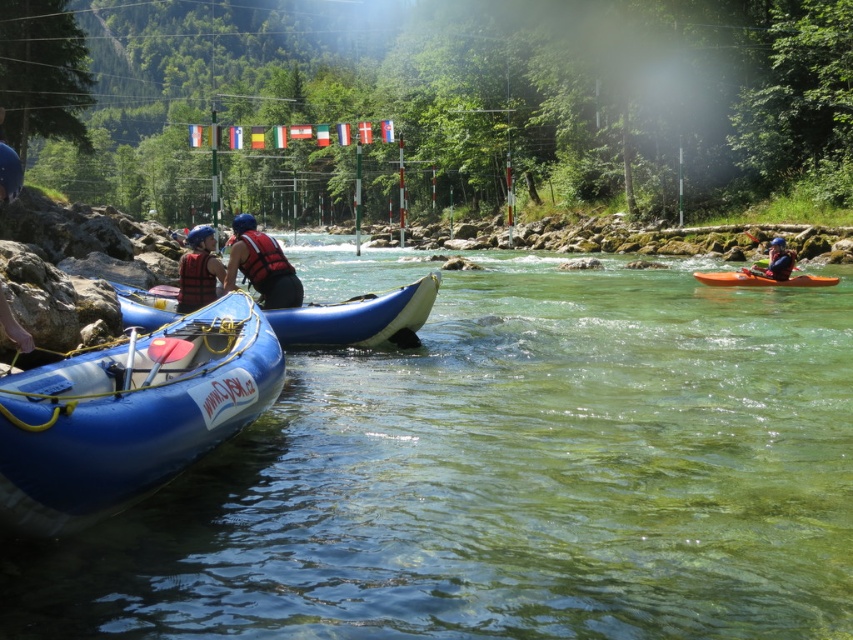
Question: Is matte blue life vest at left thinner than blue rubber raft at left?

Choices:
 (A) no
 (B) yes

Answer: (A)

Question: Is blue rubber canoe at center positioned at the back of blue rubber raft at left?

Choices:
 (A) yes
 (B) no

Answer: (A)

Question: In this image, where is blue rubber boat at lower left located relative to blue rubber canoe at center?

Choices:
 (A) below
 (B) above

Answer: (A)

Question: Which object appears closest to the camera in this image?

Choices:
 (A) matte blue life vest at left
 (B) orange matte kayak at right
 (C) matte blue kayak at right

Answer: (A)

Question: Which point is farther to the camera?

Choices:
 (A) blue rubber canoe at center
 (B) blue rubber raft at left
 (C) blue rubber boat at lower left
 (D) matte blue kayak at right

Answer: (D)

Question: Which object is farther from the camera taking this photo?

Choices:
 (A) matte blue kayak at right
 (B) matte red life jacket at left

Answer: (A)